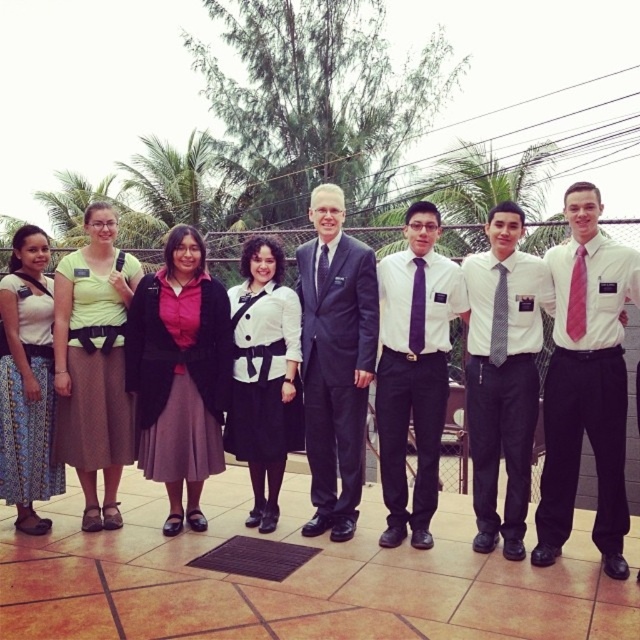
Between dark blue suit at center and purple silk tie at center, which one is positioned higher?

Positioned higher is purple silk tie at center.

Which is more to the right, dark blue suit at center or purple silk tie at center?

dark blue suit at center is more to the right.

What do you see at coordinates (336, 362) in the screenshot?
I see `dark blue suit at center` at bounding box center [336, 362].

The image size is (640, 640). Identify the location of dark blue suit at center. (336, 362).

Which of these two, purple tie at center or pink silk tie at center, stands taller?

purple tie at center

Between purple tie at center and pink silk tie at center, which one has less height?

pink silk tie at center

Who is more distant from viewer, (x=416, y=544) or (x=572, y=326)?

Point (x=416, y=544)

Find the location of `purple tie at center`. purple tie at center is located at coordinates (413, 371).

You are a GUI agent. You are given a task and a screenshot of the screen. Output one action in this format:
    pyautogui.click(x=<x>, y=<y>)
    Task: Click on the dark blue suit at center
    
    Given the screenshot: What is the action you would take?
    pyautogui.click(x=336, y=362)

Is dark blue suit at center above printed cotton skirt at lower left?

Yes.

Identify the location of dark blue suit at center. The height and width of the screenshot is (640, 640). (336, 362).